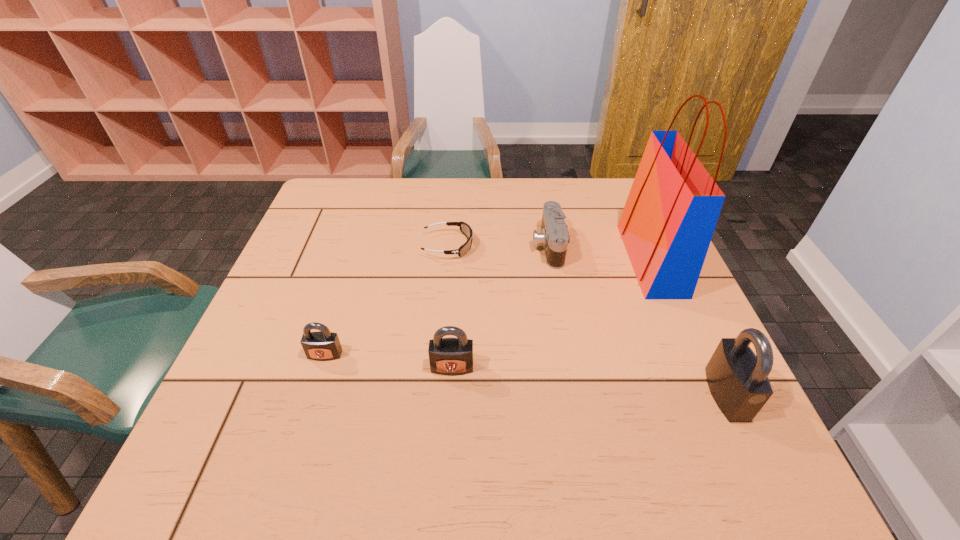
Locate an element on the screen. This screenshot has height=540, width=960. free space in the image that satisfies the following two spatial constraints: 1. on the handle side of the shopping bag; 2. on the front of the fourth shortest object near the keyhole is located at coordinates (697, 367).

At what (x,y) coordinates should I click in order to perform the action: click on vacant point that satisfies the following two spatial constraints: 1. on the handle side of the tallest object; 2. on the front of the shortest padlock near the keyhole. Please return your answer as a coordinate pair (x, y). The width and height of the screenshot is (960, 540). Looking at the image, I should click on (692, 355).

Where is `vacant space that satisfies the following two spatial constraints: 1. on the front and sides of the shortest object; 2. on the front of the leftmost object near the keyhole`? This screenshot has height=540, width=960. vacant space that satisfies the following two spatial constraints: 1. on the front and sides of the shortest object; 2. on the front of the leftmost object near the keyhole is located at coordinates (439, 355).

Locate an element on the screen. This screenshot has height=540, width=960. vacant point that satisfies the following two spatial constraints: 1. on the lens of the fourth object from left to right; 2. on the front of the fourth shortest object near the keyhole is located at coordinates (570, 367).

Find the location of `vacant space that satisfies the following two spatial constraints: 1. on the front and sides of the goggles; 2. on the front of the leftmost object near the keyhole`. vacant space that satisfies the following two spatial constraints: 1. on the front and sides of the goggles; 2. on the front of the leftmost object near the keyhole is located at coordinates pyautogui.click(x=439, y=355).